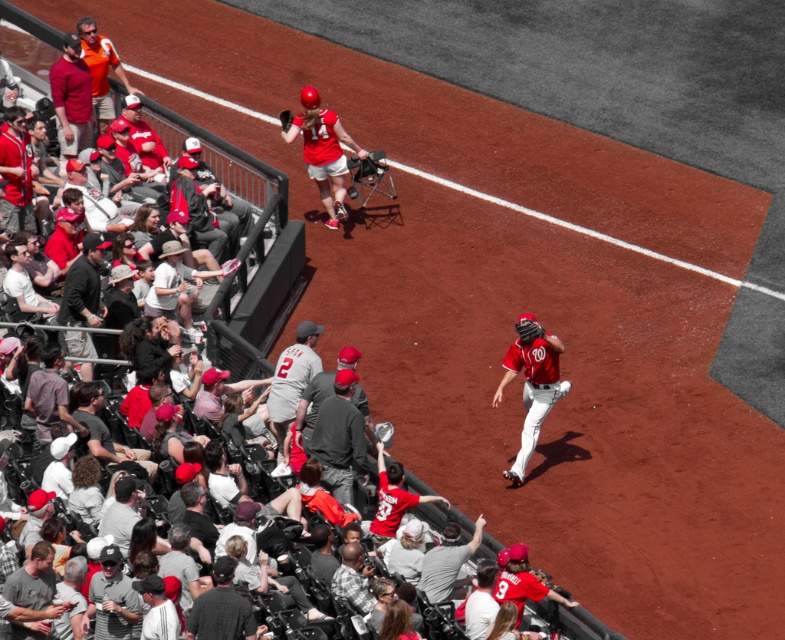
You are a photographer trying to capture the action of the red jersey baseball player at center and the matte red helmet at upper center. Which object should you zoom in on to get a clearer image of the subject?

The red jersey baseball player at center is bigger than the matte red helmet at upper center, so you should zoom in on the red jersey baseball player at center to get a clearer image of the subject.

You are a photographer at the baseball game and want to capture a photo of the matte red helmet at upper center and the dark brown leather glove at upper center. Which object should you focus on first if you want to include both in your shot without moving the camera?

The dark brown leather glove at upper center should be focused on first because it is above the matte red helmet at upper center, so adjusting focus to the higher object first would allow both to be in frame.

You are a photographer trying to capture a closeup of the matte red jersey at center and the dark brown leather glove at upper center in the baseball game scene. Based on their positions, which object is positioned closer to the camera?

The matte red jersey at center is positioned closer to the camera than the dark brown leather glove at upper center because it is located at the center of the image, while the glove is at upper center, which is further away from the camera perspective.